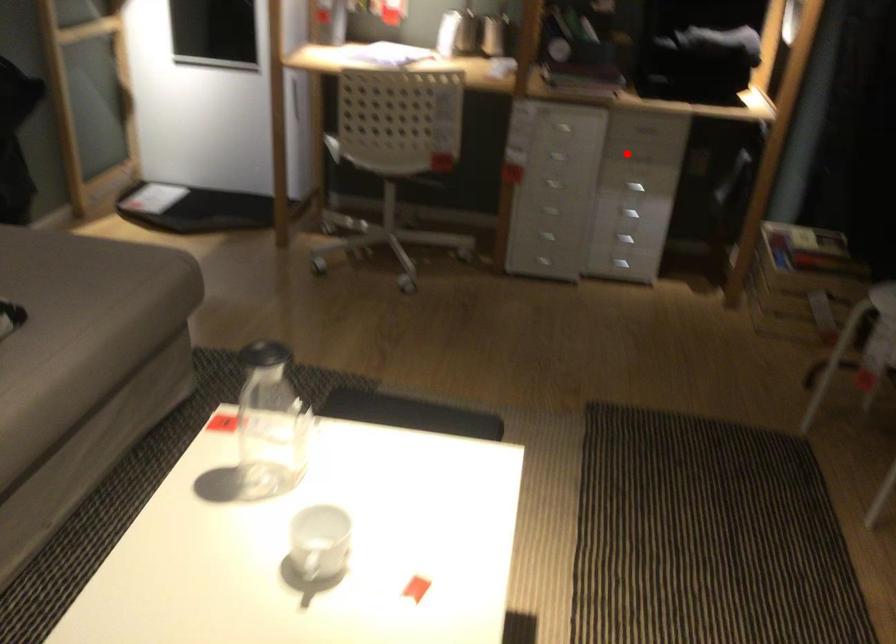
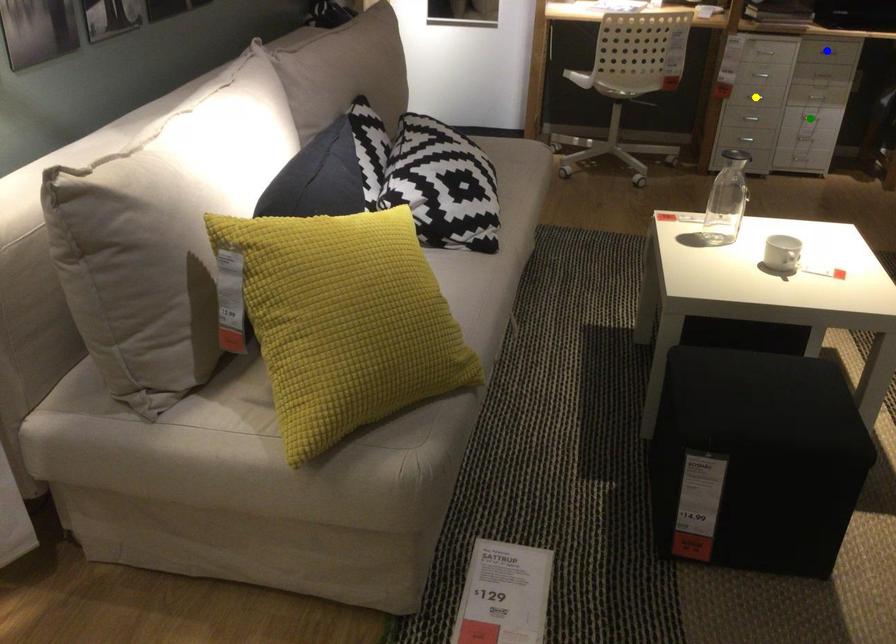
Question: I am providing you with two images of the same scene from different viewpoints. A red point is marked on the first image. You are given multiple points on the second image. Which spot in image 2 lines up with the point in image 1?

Choices:
 (A) yellow point
 (B) blue point
 (C) green point

Answer: (B)